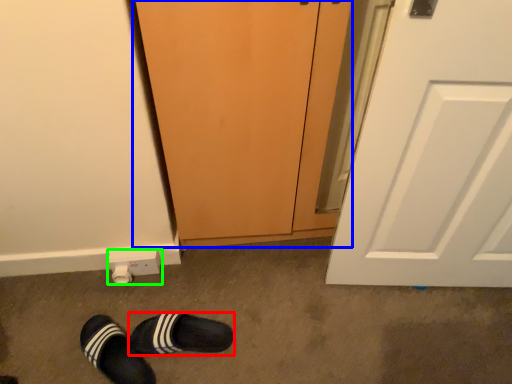
Question: Considering the real-world distances, which object is farthest from footwear (highlighted by a red box)? screen door (highlighted by a blue box) or electric outlet (highlighted by a green box)?

Choices:
 (A) screen door
 (B) electric outlet

Answer: (A)